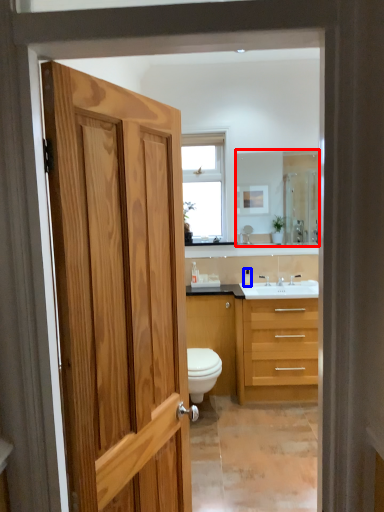
Question: Among these objects, which one is nearest to the camera, mirror (highlighted by a red box) or toiletry (highlighted by a blue box)?

Choices:
 (A) mirror
 (B) toiletry

Answer: (A)